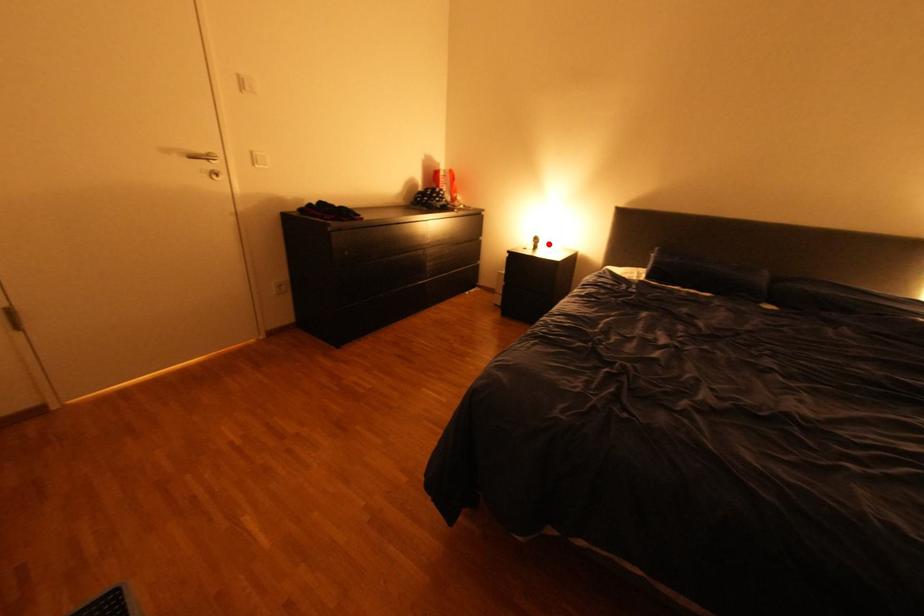
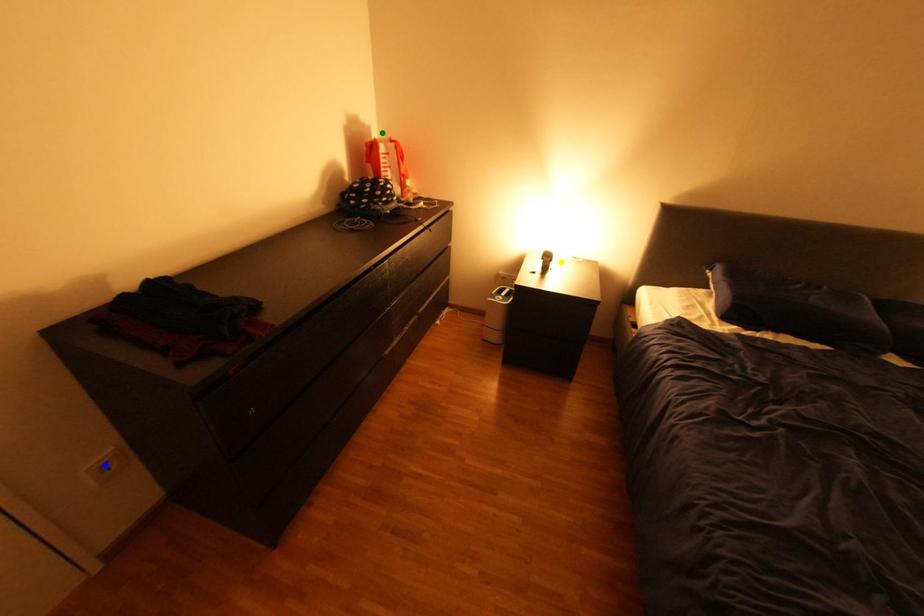
Question: I am providing you with two images of the same scene from different viewpoints. A red point is marked on the first image. You are given multiple points on the second image. In image 2, which mark is for the same physical point as the one in image 1?

Choices:
 (A) yellow point
 (B) blue point
 (C) green point

Answer: (A)